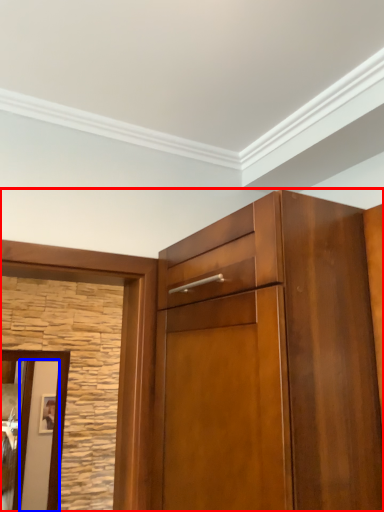
Question: Among these objects, which one is farthest to the camera, cupboard (highlighted by a red box) or door (highlighted by a blue box)?

Choices:
 (A) cupboard
 (B) door

Answer: (B)